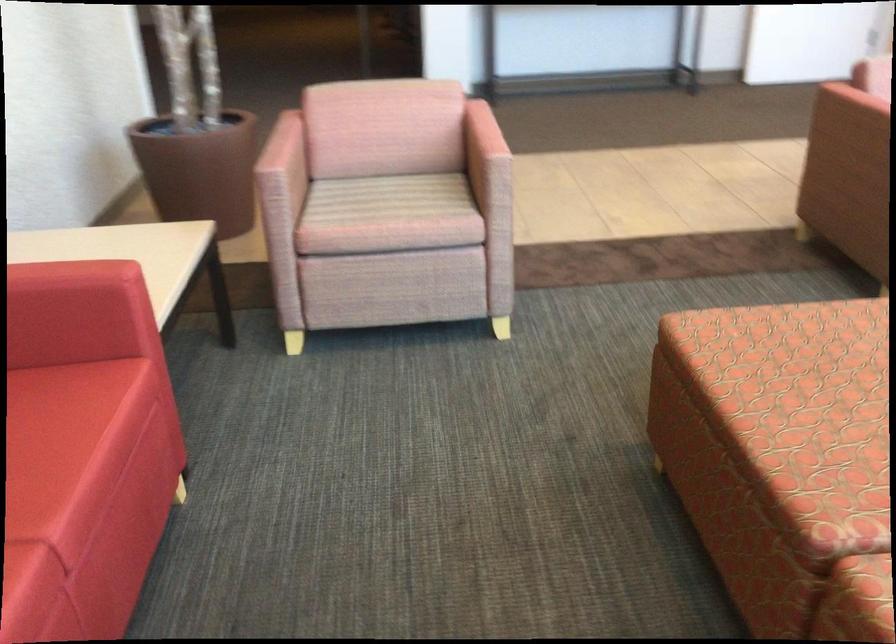
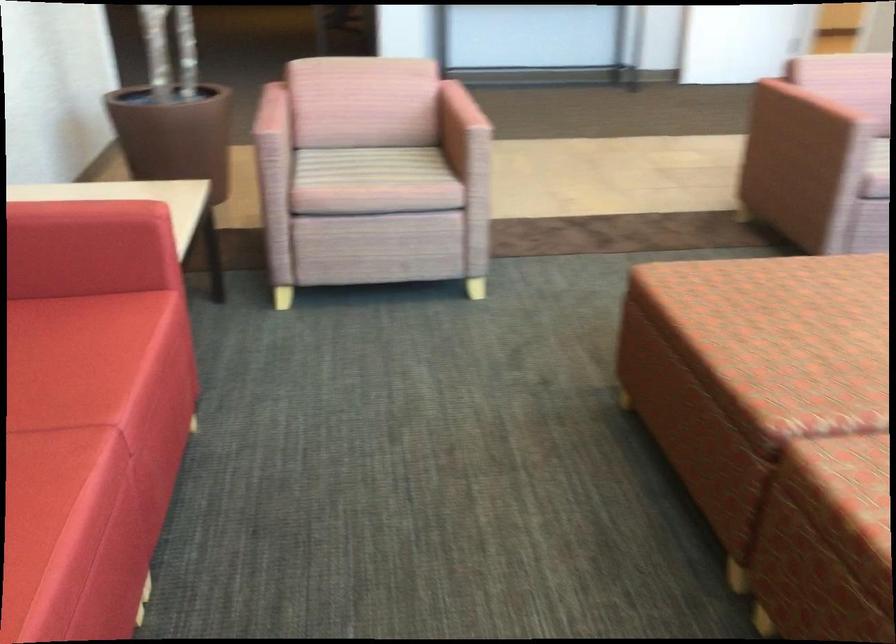
The point at (377, 201) is marked in the first image. Where is the corresponding point in the second image?

(365, 166)